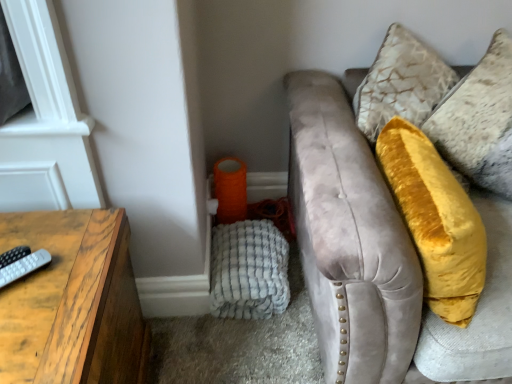
Locate an element on the screen. This screenshot has width=512, height=384. gray matte remote at left is located at coordinates (24, 266).

This screenshot has width=512, height=384. What do you see at coordinates (479, 120) in the screenshot?
I see `velvet yellow pillow at upper right` at bounding box center [479, 120].

At what (x,y) coordinates should I click in order to perform the action: click on wooden table at left. Please return your answer as a coordinate pair (x, y). Looking at the image, I should click on (71, 301).

Locate an element on the screen. The image size is (512, 384). gray matte remote at left is located at coordinates (24, 266).

Can you confirm if velvet gray studio couch at right is positioned to the right of velvet yellow pillow at upper right?

No.

How many degrees apart are the facing directions of velvet gray studio couch at right and velvet yellow pillow at upper right?

velvet gray studio couch at right and velvet yellow pillow at upper right are facing 22.1 degrees away from each other.

Is velvet gray studio couch at right looking in the opposite direction of velvet yellow pillow at upper right?

Correct, velvet gray studio couch at right is looking away from velvet yellow pillow at upper right.

Which of these two, velvet gray studio couch at right or velvet yellow pillow at upper right, is smaller?

velvet yellow pillow at upper right.

Considering the relative sizes of wooden table at left and white textured blanket at lower left in the image provided, is wooden table at left smaller than white textured blanket at lower left?

No.

Is wooden table at left facing away from white textured blanket at lower left?

No, wooden table at left is not facing the opposite direction of white textured blanket at lower left.

From the image's perspective, is wooden table at left located above or below white textured blanket at lower left?

wooden table at left is situated lower than white textured blanket at lower left in the image.

Is white textured blanket at lower left surrounded by wooden table at left?

No, white textured blanket at lower left is not inside wooden table at left.

In terms of height, does velvet gray studio couch at right look taller or shorter compared to gray matte remote at left?

In the image, velvet gray studio couch at right appears to be taller than gray matte remote at left.

In terms of width, does velvet gray studio couch at right look wider or thinner when compared to gray matte remote at left?

velvet gray studio couch at right is wider than gray matte remote at left.

Choose the correct answer: Is velvet gray studio couch at right inside gray matte remote at left or outside it?

velvet gray studio couch at right exists outside the volume of gray matte remote at left.

Which is in front, point (351, 235) or point (48, 254)?

Point (351, 235)

Looking at this image, what's the angular difference between gray matte remote at left and white textured blanket at lower left's facing directions?

The angular difference between gray matte remote at left and white textured blanket at lower left is 48.6 degrees.

From a real-world perspective, is gray matte remote at left positioned under white textured blanket at lower left based on gravity?

No, from a real-world perspective, gray matte remote at left is not under white textured blanket at lower left.

Between gray matte remote at left and white textured blanket at lower left, which one has larger size?

Bigger between the two is white textured blanket at lower left.

Which is more to the right, gray matte remote at left or white textured blanket at lower left?

Positioned to the right is white textured blanket at lower left.

Considering their positions, is gray matte remote at left located in front of or behind wooden table at left?

gray matte remote at left is positioned farther from the viewer than wooden table at left.

At what (x,y) coordinates should I click in order to perform the action: click on table that is in front of the gray matte remote at left. Please return your answer as a coordinate pair (x, y). This screenshot has height=384, width=512. Looking at the image, I should click on (71, 301).

Which of these two, gray matte remote at left or wooden table at left, is smaller?

Smaller between the two is gray matte remote at left.

From the image's perspective, between white textured blanket at lower left and gray matte remote at left, who is located below?

From the image's view, white textured blanket at lower left is below.

Is white textured blanket at lower left to the right of gray matte remote at left from the viewer's perspective?

Correct, you'll find white textured blanket at lower left to the right of gray matte remote at left.

How far apart are white textured blanket at lower left and gray matte remote at left?

30.97 inches.

Can you confirm if velvet gray studio couch at right is smaller than wooden table at left?

No.

Would you consider velvet gray studio couch at right to be distant from wooden table at left?

velvet gray studio couch at right is near wooden table at left, not far away.

How distant is velvet gray studio couch at right from wooden table at left?

69.29 centimeters.

Consider the image. In the image, is velvet gray studio couch at right on the left side or the right side of wooden table at left?

In the image, velvet gray studio couch at right appears on the right side of wooden table at left.

Where is `pillow positioned vertically above the velvet gray studio couch at right (from a real-world perspective)`? This screenshot has height=384, width=512. pillow positioned vertically above the velvet gray studio couch at right (from a real-world perspective) is located at coordinates (479, 120).

Where is `table lying on the left of white textured blanket at lower left`? The height and width of the screenshot is (384, 512). table lying on the left of white textured blanket at lower left is located at coordinates point(71,301).

Looking at this image, estimate the real-world distances between objects in this image. Which object is further from gray matte remote at left, white textured blanket at lower left or velvet gray studio couch at right?

The object further to gray matte remote at left is velvet gray studio couch at right.

Estimate the real-world distances between objects in this image. Which object is closer to velvet yellow pillow at upper right, velvet gray studio couch at right or wooden table at left?

velvet gray studio couch at right is positioned closer to the anchor velvet yellow pillow at upper right.

In the scene shown: Which object lies further to the anchor point white textured blanket at lower left, wooden table at left or velvet gray studio couch at right?

The object further to white textured blanket at lower left is wooden table at left.

Considering their positions, is white textured blanket at lower left positioned further to velvet gray studio couch at right than gray matte remote at left?

gray matte remote at left lies further to velvet gray studio couch at right than the other object.

From the image, which object appears to be nearer to velvet yellow pillow at upper right, gray matte remote at left or wooden table at left?

Based on the image, wooden table at left appears to be nearer to velvet yellow pillow at upper right.

Based on their spatial positions, is gray matte remote at left or velvet yellow pillow at upper right further from white textured blanket at lower left?

Based on the image, velvet yellow pillow at upper right appears to be further to white textured blanket at lower left.

When comparing their distances from velvet yellow pillow at upper right, does wooden table at left or velvet gray studio couch at right seem further?

Based on the image, wooden table at left appears to be further to velvet yellow pillow at upper right.

Estimate the real-world distances between objects in this image. Which object is closer to velvet gray studio couch at right, velvet yellow pillow at upper right or wooden table at left?

velvet yellow pillow at upper right.

Where is `studio couch between white textured blanket at lower left and velvet yellow pillow at upper right from left to right`? Image resolution: width=512 pixels, height=384 pixels. studio couch between white textured blanket at lower left and velvet yellow pillow at upper right from left to right is located at coordinates (359, 210).

This screenshot has height=384, width=512. I want to click on remote situated between wooden table at left and velvet yellow pillow at upper right from left to right, so click(24, 266).

Where is `material between gray matte remote at left and velvet gray studio couch at right from left to right`? Image resolution: width=512 pixels, height=384 pixels. material between gray matte remote at left and velvet gray studio couch at right from left to right is located at coordinates (249, 270).

This screenshot has width=512, height=384. Find the location of `studio couch located between wooden table at left and velvet yellow pillow at upper right in the left-right direction`. studio couch located between wooden table at left and velvet yellow pillow at upper right in the left-right direction is located at coordinates (359, 210).